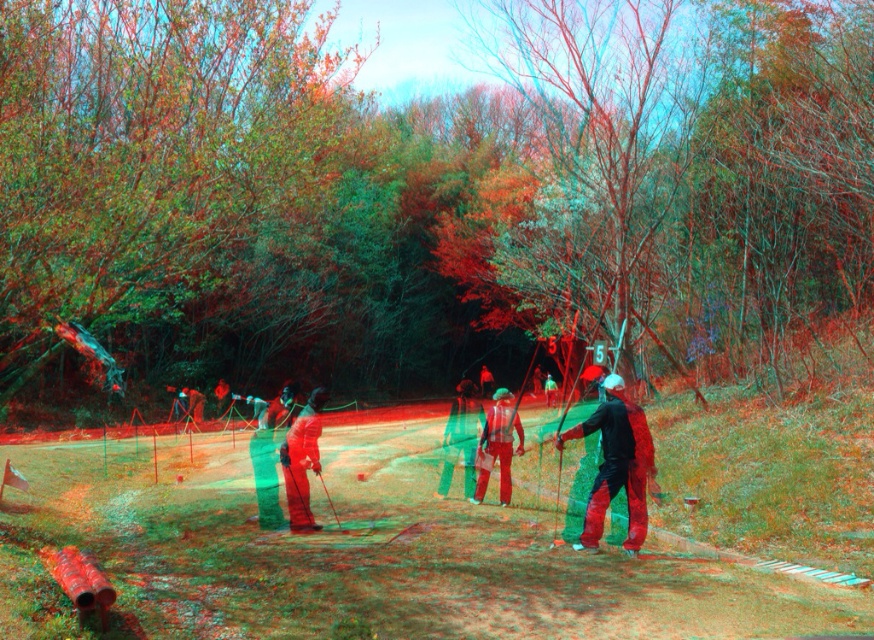
Question: Is green fabric jacket at center further to camera compared to matte red helmet at center?

Choices:
 (A) yes
 (B) no

Answer: (B)

Question: Among these points, which one is nearest to the camera?

Choices:
 (A) (637, 497)
 (B) (546, 404)
 (C) (316, 419)
 (D) (500, 502)

Answer: (A)

Question: Can you confirm if red matte pants at center is positioned above green fabric jacket at center?

Choices:
 (A) no
 (B) yes

Answer: (B)

Question: Which point is closer to the camera?

Choices:
 (A) matte black jacket at center
 (B) matte red pants at center
 (C) red matte pants at center
 (D) matte red helmet at center

Answer: (A)

Question: Is red matte pants at center wider than matte red helmet at center?

Choices:
 (A) yes
 (B) no

Answer: (B)

Question: Which point is farther to the camera?

Choices:
 (A) (320, 424)
 (B) (498, 476)
 (C) (551, 394)
 (D) (455, 401)

Answer: (D)